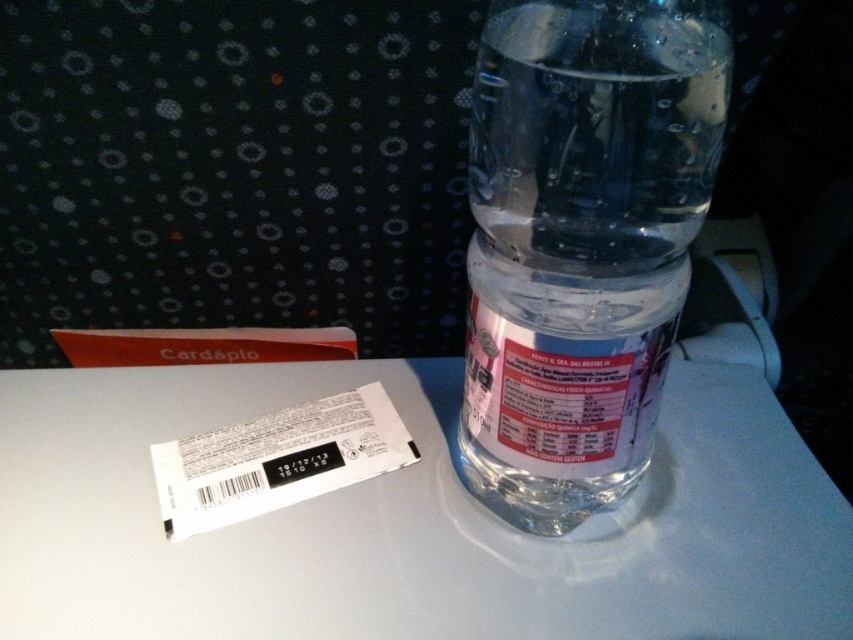
Is clear plastic bottle at center below transparent plastic bottle at center?

Yes.

Between clear plastic bottle at center and transparent plastic bottle at center, which one has less height?

Standing shorter between the two is clear plastic bottle at center.

The height and width of the screenshot is (640, 853). I want to click on clear plastic bottle at center, so click(x=409, y=522).

I want to click on clear plastic bottle at center, so click(x=409, y=522).